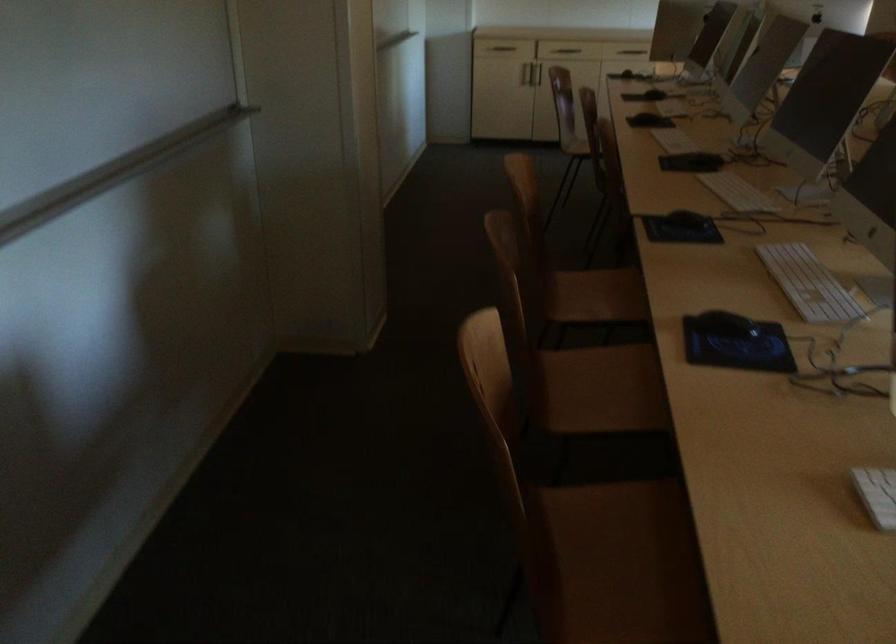
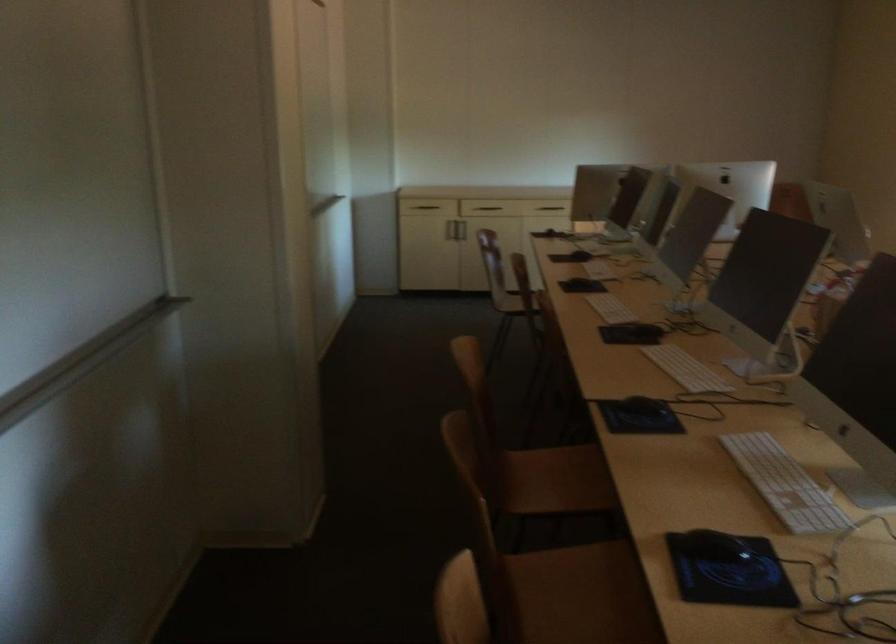
In the second image, find the point that corresponds to the point at 670,106 in the first image.

(599, 269)